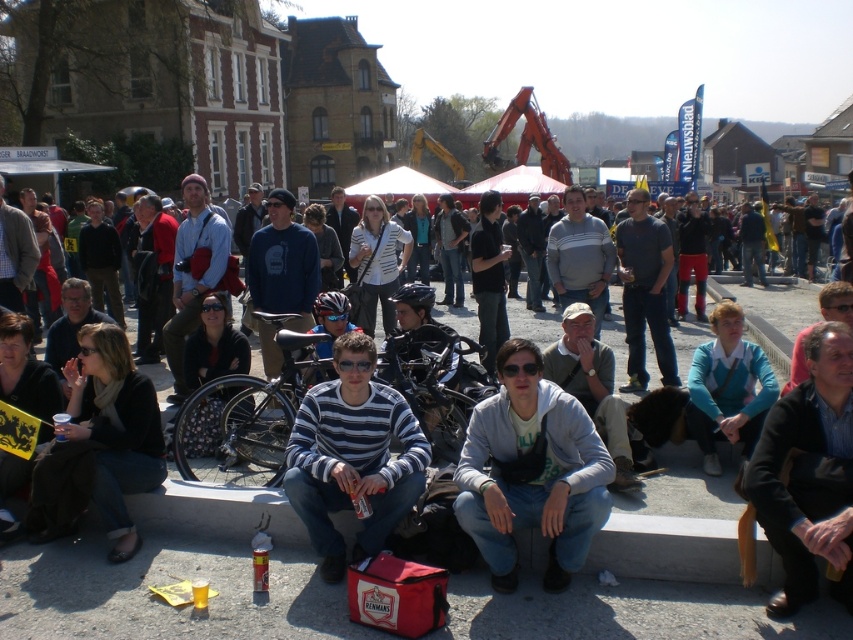
What are the coordinates of `black leather jacket at lower right` in the screenshot? It's located at (808, 474).

Consider the image. Measure the distance between black leather jacket at lower right and silver metallic bicycle at center.

The distance of black leather jacket at lower right from silver metallic bicycle at center is 8.25 meters.

Describe the element at coordinates (808, 474) in the screenshot. I see `black leather jacket at lower right` at that location.

At what (x,y) coordinates should I click in order to perform the action: click on black leather jacket at lower right. Please return your answer as a coordinate pair (x, y). Looking at the image, I should click on (808, 474).

Which is behind, point (305, 412) or point (51, 492)?

Point (305, 412)

Is striped cotton shirt at center shorter than dark gray scarf at lower left?

No, striped cotton shirt at center is not shorter than dark gray scarf at lower left.

In order to click on striped cotton shirt at center in this screenshot , I will do `click(352, 456)`.

Is the position of striped cotton shirt at center less distant than that of silver metallic bicycle at center?

Yes, it is in front of silver metallic bicycle at center.

What do you see at coordinates (352, 456) in the screenshot? I see `striped cotton shirt at center` at bounding box center [352, 456].

Find the location of a particular element. Image resolution: width=853 pixels, height=640 pixels. striped cotton shirt at center is located at coordinates (352, 456).